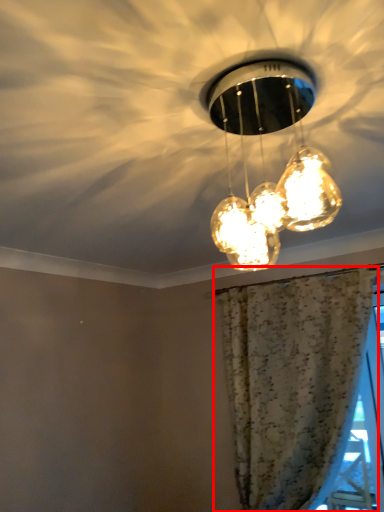
Question: From the image's perspective, where is curtain (annotated by the red box) located in relation to lamp in the image?

Choices:
 (A) below
 (B) above

Answer: (A)